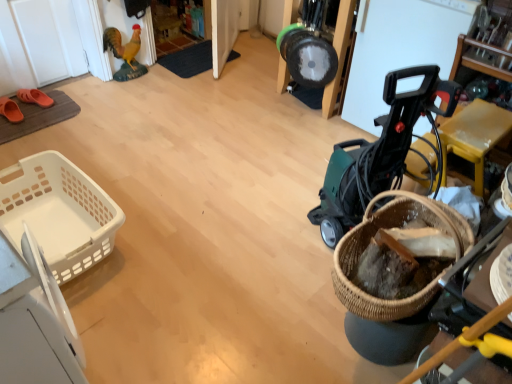
This screenshot has width=512, height=384. What do you see at coordinates (35, 97) in the screenshot?
I see `orange rubber clog at left, which ranks as the 1th footwear in back-to-front order` at bounding box center [35, 97].

Find the location of `black plastic bucket at upper center`. black plastic bucket at upper center is located at coordinates (339, 54).

What do you see at coordinates (378, 152) in the screenshot? I see `green plastic baby carriage at right` at bounding box center [378, 152].

You are a GUI agent. You are given a task and a screenshot of the screen. Output one action in this format:
    pyautogui.click(x=<x>, y=<y>)
    Task: Click on the orange rubber sandals at left, the second footwear in the back-to-front sequence
    The width and height of the screenshot is (512, 384).
    Given the screenshot: What is the action you would take?
    pyautogui.click(x=10, y=110)

How different are the orientations of woven brown basket at lower right, arranged as the 1th basket when viewed from the front, and white plastic basket at left, placed as the 1th basket when sorted from left to right, in degrees?

They differ by 90 degrees in their facing directions.

Is woven brown basket at lower right, the 2th basket viewed from the left, looking in the opposite direction of white plastic basket at left, placed as the 1th basket when sorted from left to right?

woven brown basket at lower right, the 2th basket viewed from the left, does not have its back to white plastic basket at left, placed as the 1th basket when sorted from left to right.

From the image's perspective, between woven brown basket at lower right, positioned as the 2th basket in back-to-front order, and white plastic basket at left, which appears as the 2th basket when viewed from the front, who is located below?

woven brown basket at lower right, positioned as the 2th basket in back-to-front order, is shown below in the image.

Locate an element on the screen. This screenshot has height=384, width=512. basket in front of the white plastic basket at left, placed as the second basket when sorted from right to left is located at coordinates (386, 228).

Which is correct: white plastic basket at left, placed as the 1th basket when sorted from left to right, is inside woven brown basket at lower right, arranged as the 1th basket when viewed from the front, or outside of it?

white plastic basket at left, placed as the 1th basket when sorted from left to right, is not inside woven brown basket at lower right, arranged as the 1th basket when viewed from the front, it's outside.

How many degrees apart are the facing directions of white plastic basket at left, which appears as the 2th basket when viewed from the front, and woven brown basket at lower right, the 2th basket viewed from the left?

The angular difference between white plastic basket at left, which appears as the 2th basket when viewed from the front, and woven brown basket at lower right, the 2th basket viewed from the left, is 90 degrees.

Looking at this image, is white plastic basket at left, placed as the 1th basket when sorted from left to right, facing away from woven brown basket at lower right, the first basket viewed from the right?

That's not correct — white plastic basket at left, placed as the 1th basket when sorted from left to right, is not looking away from woven brown basket at lower right, the first basket viewed from the right.

Is point (1, 173) in front of point (459, 245)?

No, (1, 173) is behind (459, 245).

Considering the relative positions of white plastic basket at left, the 1th basket when ordered from back to front, and black plastic bucket at upper center in the image provided, is white plastic basket at left, the 1th basket when ordered from back to front, to the right of black plastic bucket at upper center from the viewer's perspective?

In fact, white plastic basket at left, the 1th basket when ordered from back to front, is to the left of black plastic bucket at upper center.

Considering the relative sizes of white plastic basket at left, which appears as the 2th basket when viewed from the front, and black plastic bucket at upper center in the image provided, is white plastic basket at left, which appears as the 2th basket when viewed from the front, wider than black plastic bucket at upper center?

Correct, the width of white plastic basket at left, which appears as the 2th basket when viewed from the front, exceeds that of black plastic bucket at upper center.

Is white plastic basket at left, which appears as the 2th basket when viewed from the front, smaller than black plastic bucket at upper center?

Incorrect, white plastic basket at left, which appears as the 2th basket when viewed from the front, is not smaller in size than black plastic bucket at upper center.

Is white plastic basket at left, which appears as the 2th basket when viewed from the front, next to black plastic bucket at upper center?

white plastic basket at left, which appears as the 2th basket when viewed from the front, and black plastic bucket at upper center are clearly separated.

Which object is wider, orange rubber sandals at left, which appears as the 1th footwear when viewed from the front, or green plastic baby carriage at right?

With larger width is green plastic baby carriage at right.

What's the angular difference between orange rubber sandals at left, the second footwear in the back-to-front sequence, and green plastic baby carriage at right's facing directions?

153 degrees.

Would you say orange rubber sandals at left, the second footwear in the back-to-front sequence, is inside or outside green plastic baby carriage at right?

orange rubber sandals at left, the second footwear in the back-to-front sequence, cannot be found inside green plastic baby carriage at right.

From the image's perspective, is orange rubber sandals at left, the second footwear in the back-to-front sequence, above green plastic baby carriage at right?

Yes, from the image's perspective, orange rubber sandals at left, the second footwear in the back-to-front sequence, is above green plastic baby carriage at right.

Is orange rubber clog at left, which ranks as the 1th footwear in back-to-front order, not within white plastic basket at left, placed as the 1th basket when sorted from left to right?

Yes.

Who is bigger, orange rubber clog at left, marked as the 2th footwear in a front-to-back arrangement, or white plastic basket at left, placed as the second basket when sorted from right to left?

white plastic basket at left, placed as the second basket when sorted from right to left.

Are orange rubber clog at left, which ranks as the 1th footwear in back-to-front order, and white plastic basket at left, the 1th basket when ordered from back to front, beside each other?

No, orange rubber clog at left, which ranks as the 1th footwear in back-to-front order, is not making contact with white plastic basket at left, the 1th basket when ordered from back to front.

How far apart are orange rubber clog at left, which ranks as the 1th footwear in back-to-front order, and white plastic basket at left, placed as the 1th basket when sorted from left to right?

orange rubber clog at left, which ranks as the 1th footwear in back-to-front order, is 3.48 feet away from white plastic basket at left, placed as the 1th basket when sorted from left to right.

Does orange rubber sandals at left, the second footwear in the back-to-front sequence, appear on the right side of white plastic basket at left, which appears as the 2th basket when viewed from the front?

In fact, orange rubber sandals at left, the second footwear in the back-to-front sequence, is to the left of white plastic basket at left, which appears as the 2th basket when viewed from the front.

Is orange rubber sandals at left, which appears as the 1th footwear when viewed from the front, looking in the opposite direction of white plastic basket at left, placed as the second basket when sorted from right to left?

orange rubber sandals at left, which appears as the 1th footwear when viewed from the front, is not turned away from white plastic basket at left, placed as the second basket when sorted from right to left.

I want to click on the 1st basket below when counting from the orange rubber sandals at left, the second footwear in the back-to-front sequence (from the image's perspective), so click(59, 212).

Looking at this image, from a real-world perspective, does orange rubber sandals at left, which appears as the 1th footwear when viewed from the front, stand above white plastic basket at left, the 1th basket when ordered from back to front?

Incorrect, from a real-world perspective, orange rubber sandals at left, which appears as the 1th footwear when viewed from the front, is lower than white plastic basket at left, the 1th basket when ordered from back to front.

Is black plastic bucket at upper center oriented away from woven brown basket at lower right, arranged as the 1th basket when viewed from the front?

black plastic bucket at upper center is not turned away from woven brown basket at lower right, arranged as the 1th basket when viewed from the front.

Which of these two, black plastic bucket at upper center or woven brown basket at lower right, the 2th basket viewed from the left, is smaller?

With smaller size is woven brown basket at lower right, the 2th basket viewed from the left.

Is black plastic bucket at upper center closer to the viewer compared to woven brown basket at lower right, the 2th basket viewed from the left?

That is False.

Is black plastic bucket at upper center positioned far away from woven brown basket at lower right, the 2th basket viewed from the left?

black plastic bucket at upper center is positioned a significant distance from woven brown basket at lower right, the 2th basket viewed from the left.

The image size is (512, 384). I want to click on basket below the white plastic basket at left, the 1th basket when ordered from back to front (from the image's perspective), so click(x=386, y=228).

At what (x,y) coordinates should I click in order to perform the action: click on basket above the white plastic basket at left, the 1th basket when ordered from back to front (from a real-world perspective). Please return your answer as a coordinate pair (x, y). Image resolution: width=512 pixels, height=384 pixels. Looking at the image, I should click on (386, 228).

Looking at the image, which one is located closer to white plastic basket at left, the 1th basket when ordered from back to front, woven brown basket at lower right, the 2th basket viewed from the left, or black plastic bucket at upper center?

woven brown basket at lower right, the 2th basket viewed from the left, lies closer to white plastic basket at left, the 1th basket when ordered from back to front, than the other object.

Based on their spatial positions, is woven brown basket at lower right, the 2th basket viewed from the left, or green plastic baby carriage at right closer to black plastic bucket at upper center?

Based on the image, green plastic baby carriage at right appears to be nearer to black plastic bucket at upper center.

When comparing their distances from white plastic basket at left, which appears as the 2th basket when viewed from the front, does black plastic bucket at upper center or green plastic baby carriage at right seem closer?

green plastic baby carriage at right is positioned closer to the anchor white plastic basket at left, which appears as the 2th basket when viewed from the front.

Considering their positions, is woven brown basket at lower right, positioned as the 2th basket in back-to-front order, positioned further to orange rubber sandals at left, which appears as the 1th footwear when viewed from the front, than white plastic basket at left, the 1th basket when ordered from back to front?

woven brown basket at lower right, positioned as the 2th basket in back-to-front order, is positioned further to the anchor orange rubber sandals at left, which appears as the 1th footwear when viewed from the front.

Based on their spatial positions, is green plastic baby carriage at right or orange rubber clog at left, which ranks as the 1th footwear in back-to-front order, further from black plastic bucket at upper center?

orange rubber clog at left, which ranks as the 1th footwear in back-to-front order.

Estimate the real-world distances between objects in this image. Which object is closer to woven brown basket at lower right, arranged as the 1th basket when viewed from the front, orange rubber clog at left, marked as the 2th footwear in a front-to-back arrangement, or black plastic bucket at upper center?

The object closer to woven brown basket at lower right, arranged as the 1th basket when viewed from the front, is black plastic bucket at upper center.

Which object lies nearer to the anchor point woven brown basket at lower right, arranged as the 1th basket when viewed from the front, orange rubber clog at left, marked as the 2th footwear in a front-to-back arrangement, or orange rubber sandals at left, which appears as the 1th footwear when viewed from the front?

Among the two, orange rubber sandals at left, which appears as the 1th footwear when viewed from the front, is located nearer to woven brown basket at lower right, arranged as the 1th basket when viewed from the front.

Estimate the real-world distances between objects in this image. Which object is further from white plastic basket at left, placed as the second basket when sorted from right to left, black plastic bucket at upper center or orange rubber clog at left, which ranks as the 1th footwear in back-to-front order?

black plastic bucket at upper center lies further to white plastic basket at left, placed as the second basket when sorted from right to left, than the other object.

Locate an element on the screen. This screenshot has width=512, height=384. furniture located between white plastic basket at left, the 1th basket when ordered from back to front, and woven brown basket at lower right, positioned as the 2th basket in back-to-front order, in the left-right direction is located at coordinates (339, 54).

Locate an element on the screen. The width and height of the screenshot is (512, 384). basket between orange rubber clog at left, marked as the 2th footwear in a front-to-back arrangement, and woven brown basket at lower right, positioned as the 2th basket in back-to-front order is located at coordinates (59, 212).

Locate an element on the screen. This screenshot has width=512, height=384. basket between orange rubber sandals at left, the second footwear in the back-to-front sequence, and woven brown basket at lower right, arranged as the 1th basket when viewed from the front, in the horizontal direction is located at coordinates (59, 212).

Locate an element on the screen. The height and width of the screenshot is (384, 512). footwear situated between orange rubber sandals at left, which appears as the 1th footwear when viewed from the front, and woven brown basket at lower right, positioned as the 2th basket in back-to-front order, from left to right is located at coordinates (35, 97).